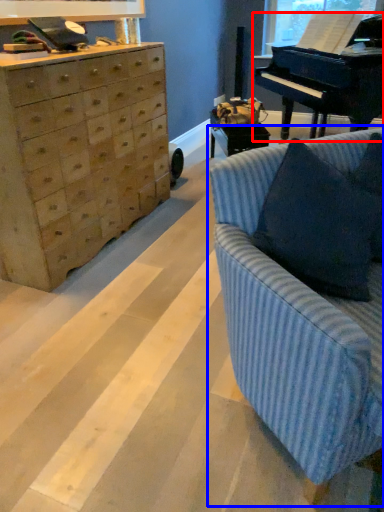
Question: Which object appears closest to the camera in this image, piano (highlighted by a red box) or studio couch (highlighted by a blue box)?

Choices:
 (A) piano
 (B) studio couch

Answer: (B)